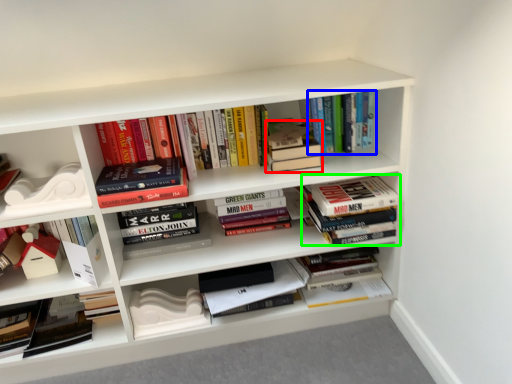
Question: Which object is positioned farthest from book (highlighted by a red box)? Select from book (highlighted by a blue box) and book (highlighted by a green box).

Choices:
 (A) book
 (B) book

Answer: (B)